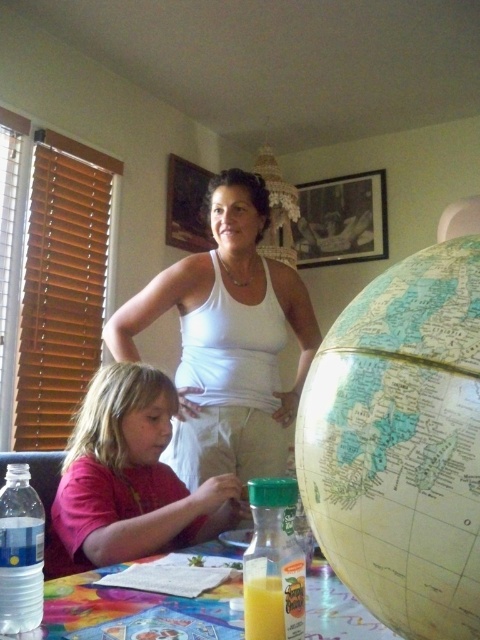
You are a guest at this table and want to place your phone on the table without covering any of the existing items. Given the sizes of the pink fabric shirt at lower left and the translucent plastic bottle of orange juice at table, which item should you avoid placing your phone on top of?

You should avoid placing your phone on top of the pink fabric shirt at lower left because it is bigger than the translucent plastic bottle of orange juice at table, so it might cover more of the shirt if placed there.

You are a photographer taking a picture of the scene. You need to ensure both the white matte tank top at upper center and the pink fabric shirt at lower left are visible in the frame. Which object should you position closer to the center of the camera to include both in the shot?

To include both the white matte tank top at upper center and the pink fabric shirt at lower left in the frame, position the white matte tank top at upper center closer to the center since it is already to the right of the pink fabric shirt at lower left, balancing their positions.